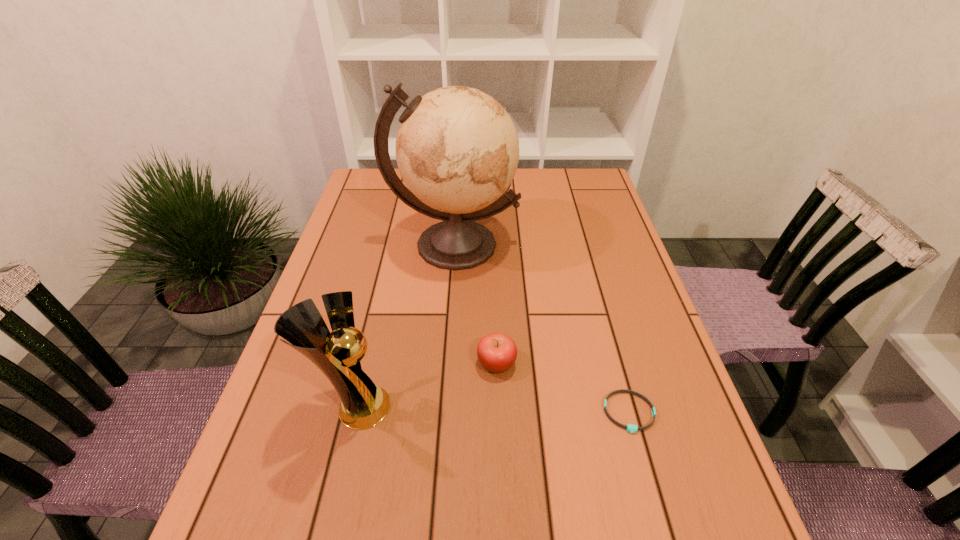
Locate an element on the screen. The image size is (960, 540). vacant space that's between the wristband and the second tallest object is located at coordinates (492, 410).

The image size is (960, 540). I want to click on blank region between the second shortest object and the wristband, so click(x=563, y=388).

Find the location of a particular element. This screenshot has width=960, height=540. free space between the shortest object and the award is located at coordinates (492, 410).

This screenshot has height=540, width=960. I want to click on free space that is in between the third tallest object and the tallest object, so click(475, 304).

The width and height of the screenshot is (960, 540). Find the location of `free space between the tallest object and the wristband`. free space between the tallest object and the wristband is located at coordinates pyautogui.click(x=541, y=329).

Image resolution: width=960 pixels, height=540 pixels. I want to click on blank region between the rightmost object and the apple, so click(563, 388).

You are a GUI agent. You are given a task and a screenshot of the screen. Output one action in this format:
    pyautogui.click(x=<x>, y=<y>)
    Task: Click on the vacant space in between the tallest object and the third shortest object
    The height and width of the screenshot is (540, 960).
    Given the screenshot: What is the action you would take?
    pyautogui.click(x=404, y=326)

Identify which object is located as the third nearest to the shortest object. Please provide its 2D coordinates. Your answer should be formatted as a tuple, i.e. [(x, y)], where the tuple contains the x and y coordinates of a point satisfying the conditions above.

[(363, 405)]

Identify the location of object that is the second nearest to the farthest object. This screenshot has height=540, width=960. [363, 405].

The height and width of the screenshot is (540, 960). Find the location of `free space that satisfies the following two spatial constraints: 1. on the front-facing side of the third tallest object; 2. on the left side of the tallest object`. free space that satisfies the following two spatial constraints: 1. on the front-facing side of the third tallest object; 2. on the left side of the tallest object is located at coordinates (445, 363).